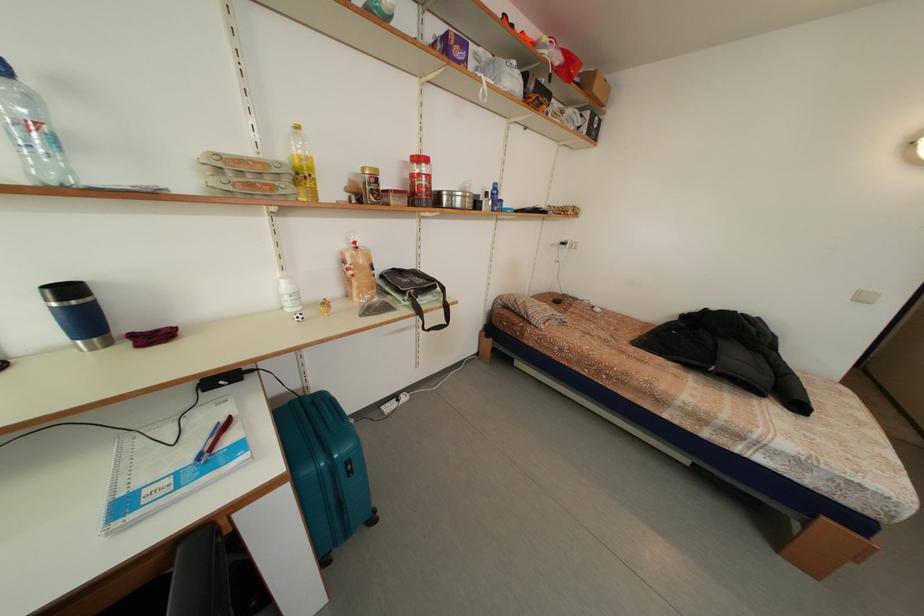
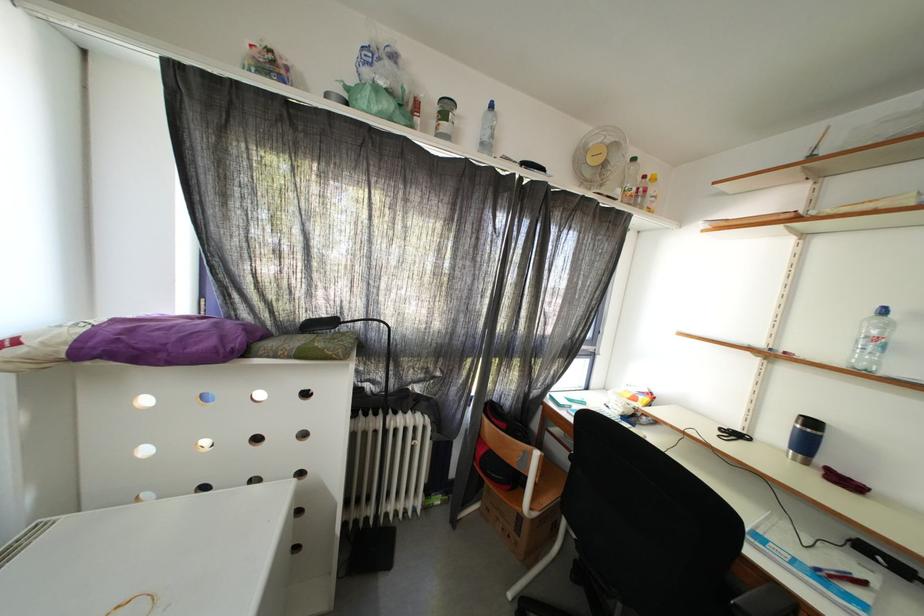
Find the pixel in the second image that matches point (209, 460) in the first image.

(827, 573)